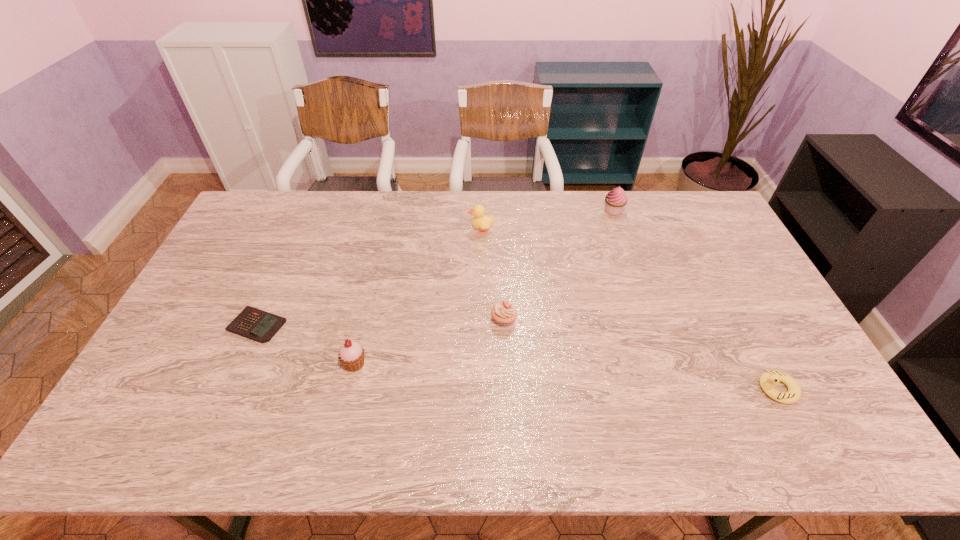
Where is `calculator`? calculator is located at coordinates (252, 323).

Locate an element on the screen. This screenshot has height=540, width=960. blank space located on the left of the fifth object from left to right is located at coordinates (498, 211).

The width and height of the screenshot is (960, 540). I want to click on vacant space located 0.350m on the front-facing side of the taller duckling, so click(x=370, y=230).

What are the coordinates of `blank space located on the front-facing side of the taller duckling` in the screenshot? It's located at 381,230.

Locate an element on the screen. This screenshot has width=960, height=540. free location located 0.070m on the front-facing side of the taller duckling is located at coordinates (448, 230).

You are a GUI agent. You are given a task and a screenshot of the screen. Output one action in this format:
    pyautogui.click(x=<x>, y=<y>)
    Task: Click on the free space located on the right of the leftmost cupcake
    The image size is (960, 540).
    Given the screenshot: What is the action you would take?
    pyautogui.click(x=446, y=364)

Locate an element on the screen. The width and height of the screenshot is (960, 540). blank space located 0.270m on the left of the second cupcake from left to right is located at coordinates (398, 319).

Where is `vacant space located on the face of the shorter duckling`? This screenshot has height=540, width=960. vacant space located on the face of the shorter duckling is located at coordinates (639, 389).

Where is `free space located 0.130m on the face of the shorter duckling`? The height and width of the screenshot is (540, 960). free space located 0.130m on the face of the shorter duckling is located at coordinates (706, 389).

The height and width of the screenshot is (540, 960). In order to click on free space located 0.180m on the face of the shorter duckling in this screenshot , I will do `click(686, 389)`.